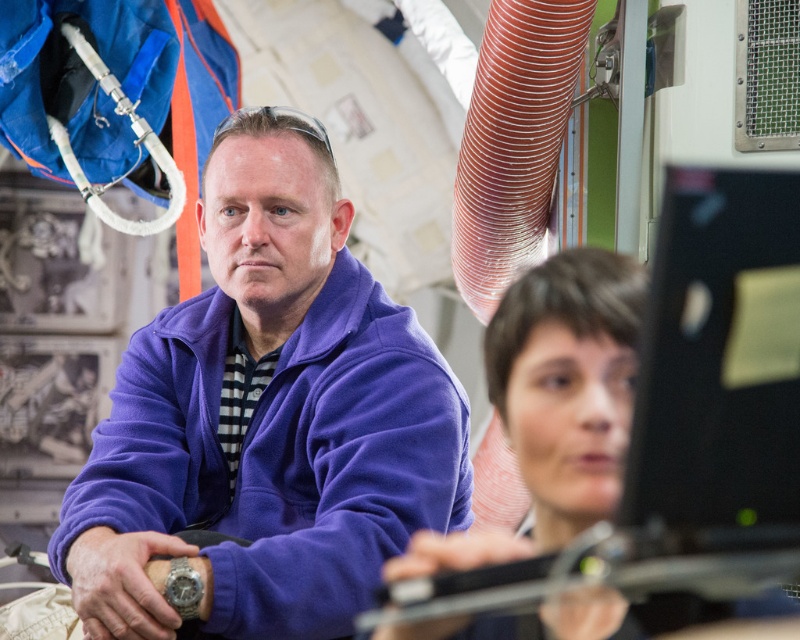
Question: Can you confirm if purple fleece jacket at center is wider than smooth brown hair at center?

Choices:
 (A) no
 (B) yes

Answer: (B)

Question: Is purple fleece jacket at center closer to the viewer compared to smooth brown hair at center?

Choices:
 (A) no
 (B) yes

Answer: (A)

Question: Can you confirm if purple fleece jacket at center is positioned to the left of smooth brown hair at center?

Choices:
 (A) yes
 (B) no

Answer: (A)

Question: Which point appears farthest from the camera in this image?

Choices:
 (A) (268, 621)
 (B) (572, 461)

Answer: (A)

Question: Which object is farther from the camera taking this photo?

Choices:
 (A) smooth brown hair at center
 (B) purple fleece jacket at center

Answer: (B)